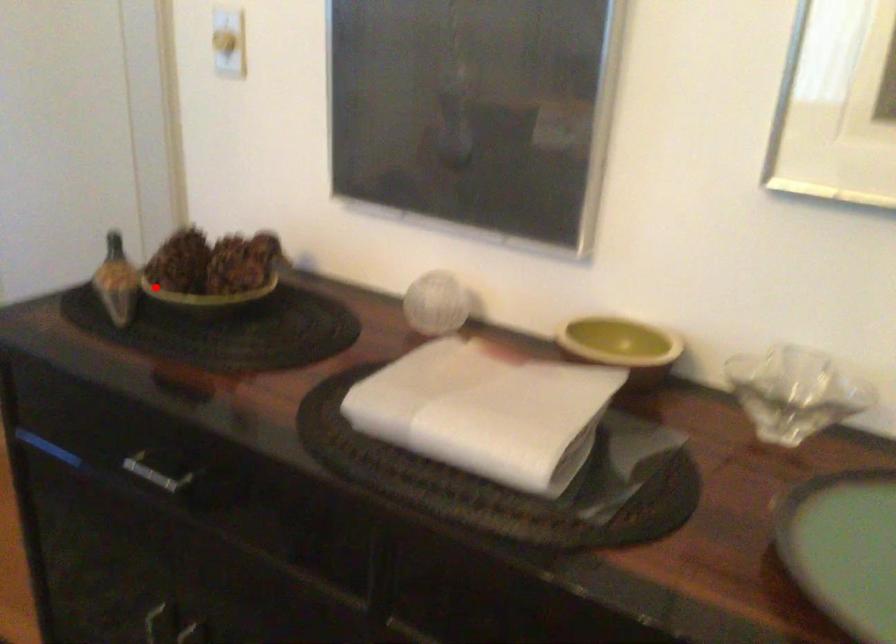
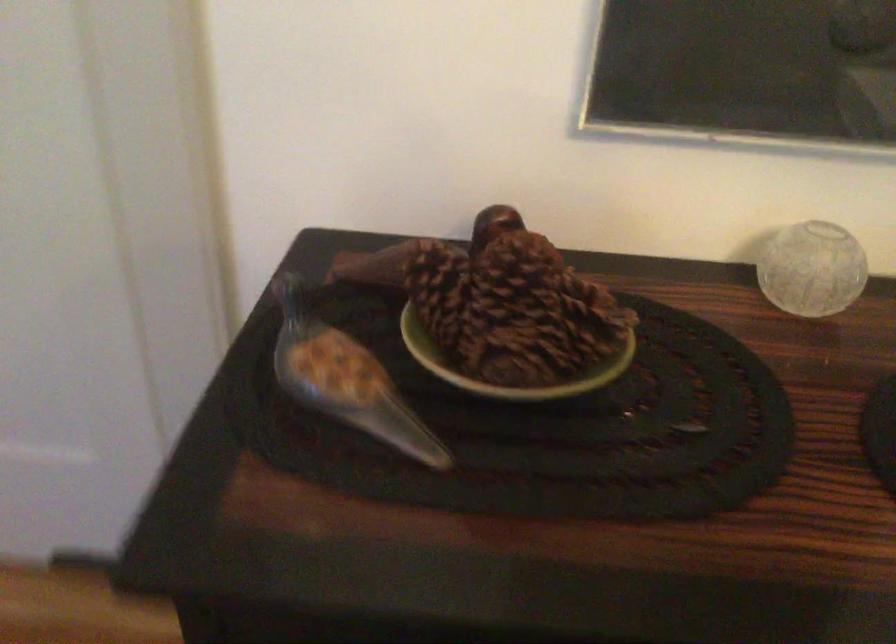
Question: I am providing you with two images of the same scene from different viewpoints. A red point is shown in image1. For the corresponding object point in image2, is it positioned nearer or farther from the camera?

Choices:
 (A) Nearer
 (B) Farther

Answer: (A)